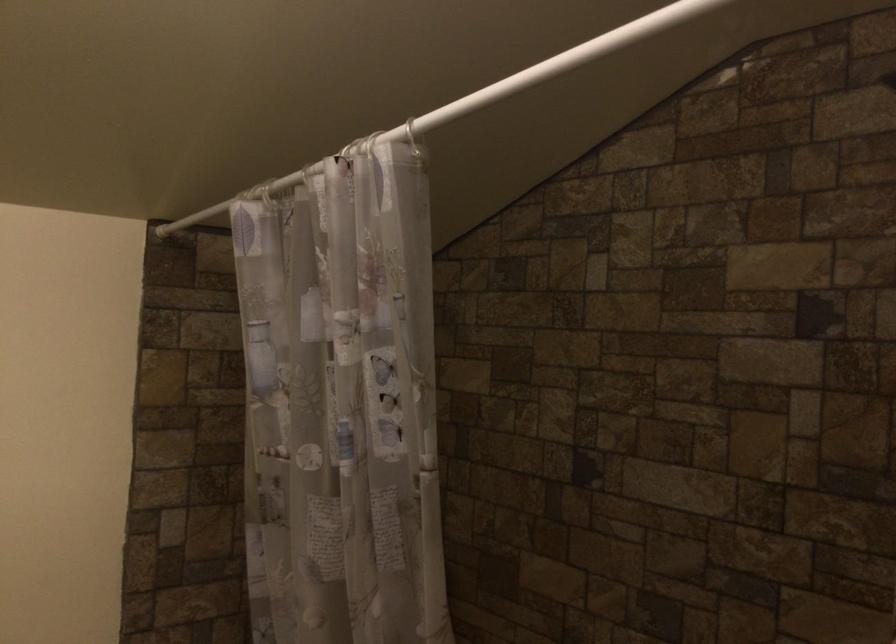
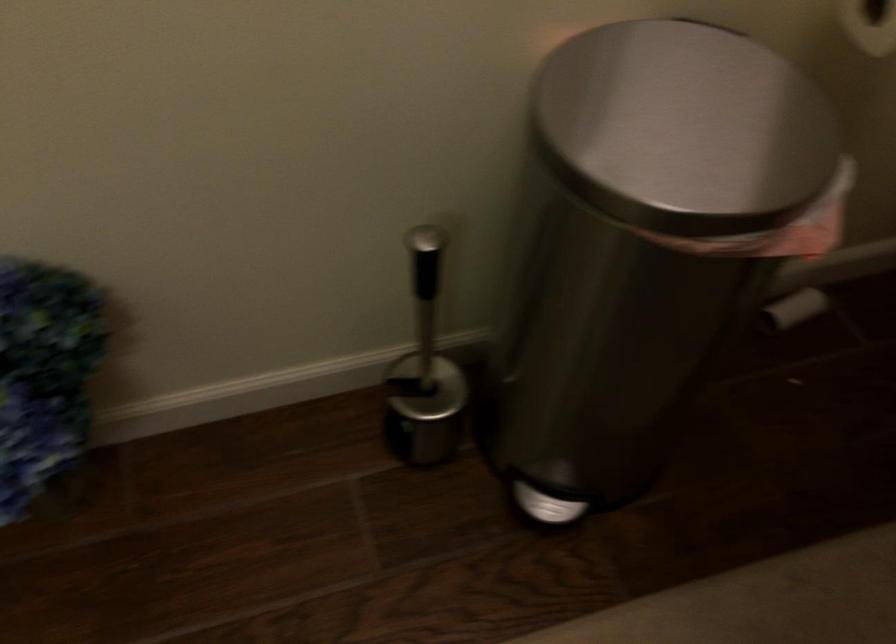
First-person continuous shooting, in which direction is the camera rotating?

The camera's rotation is toward left-down.